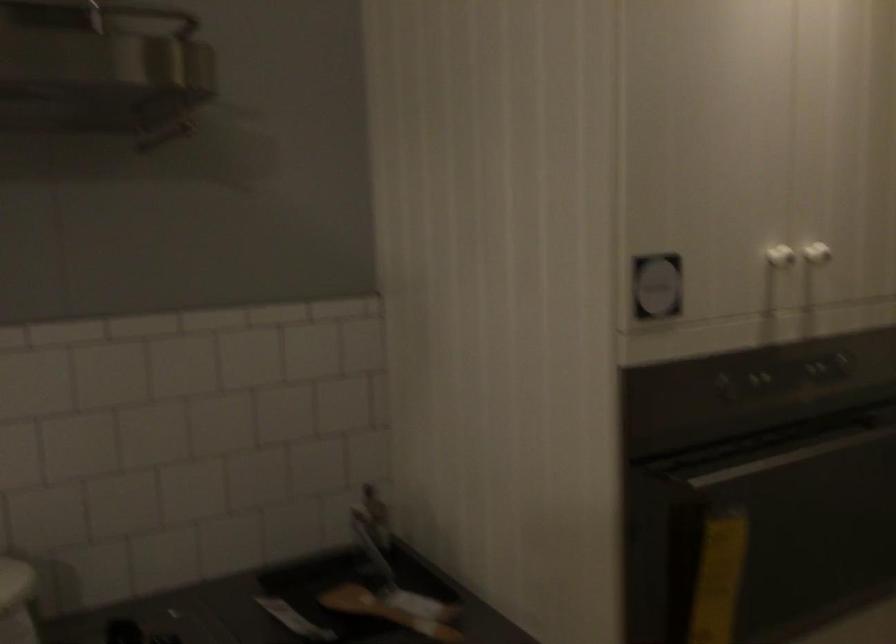
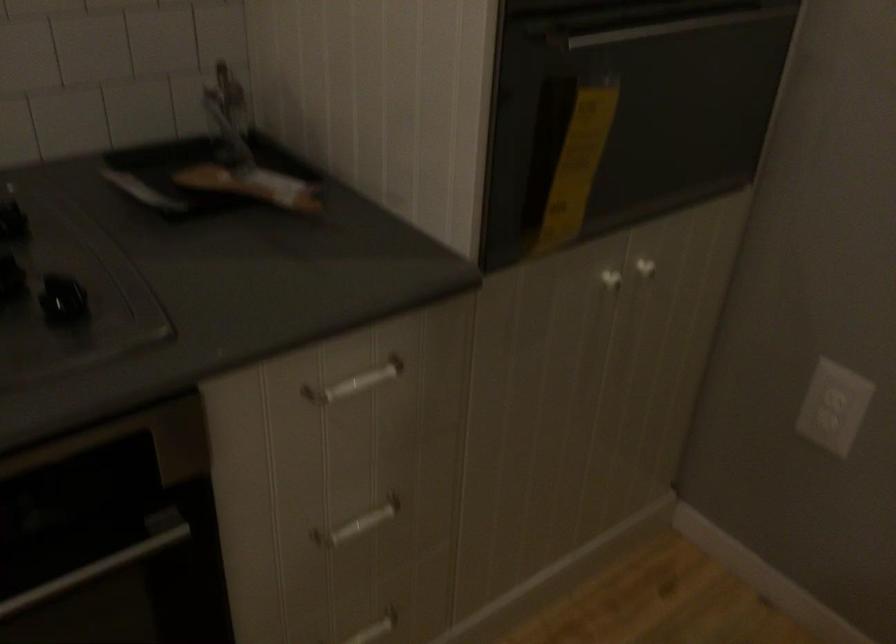
Where in the second image is the point corresponding to pixel 743 471 from the first image?

(622, 31)